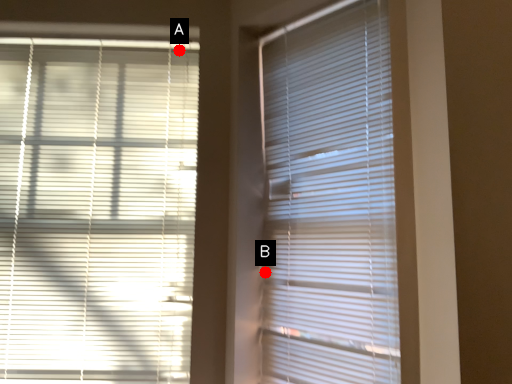
Question: Two points are circled on the image, labeled by A and B beside each circle. Which point is farther to the camera?

Choices:
 (A) A is further
 (B) B is further

Answer: (A)